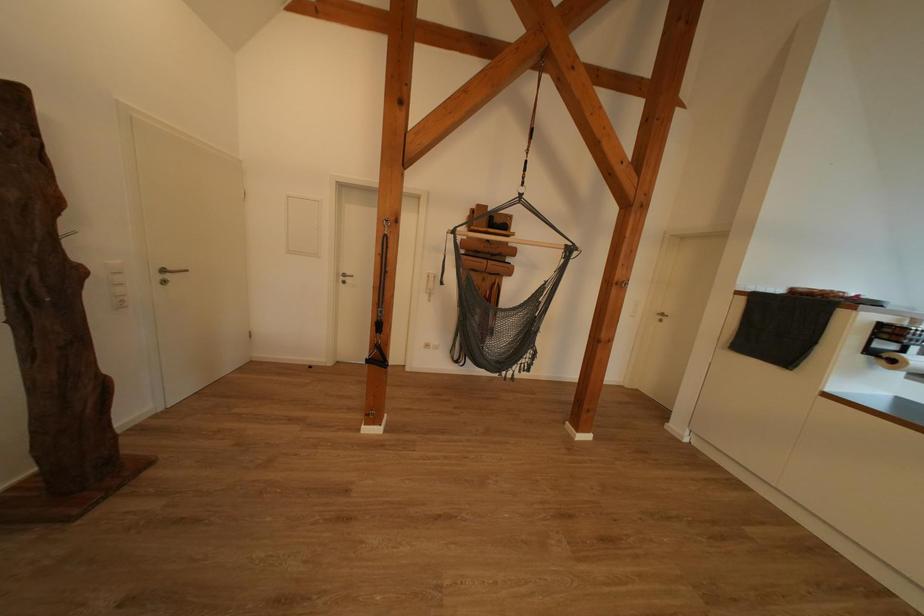
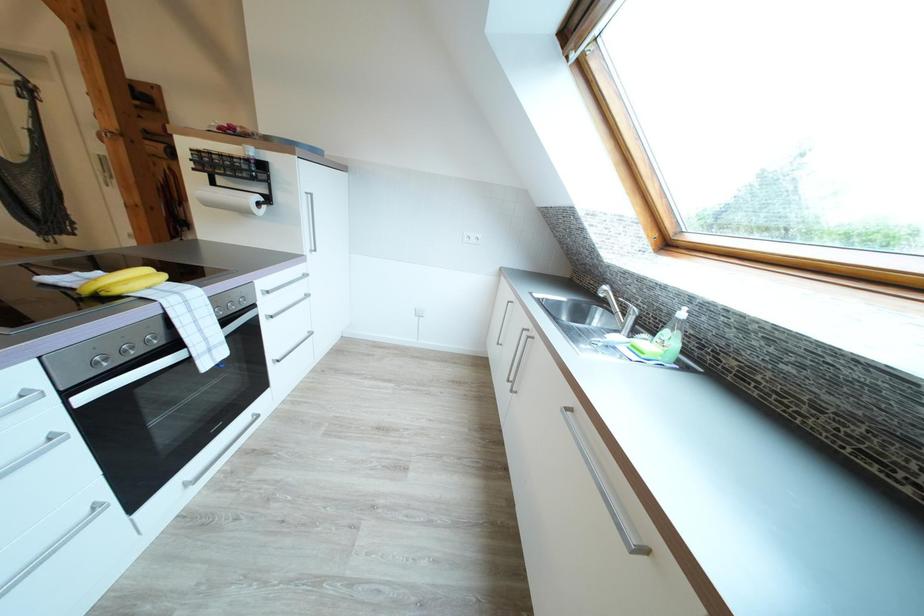
Question: The images are taken continuously from a first-person perspective. In which direction are you moving?

Choices:
 (A) Left
 (B) Right
 (C) Forward
 (D) Backward

Answer: (B)